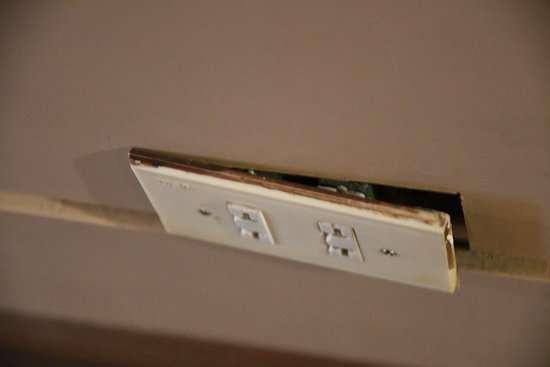
Find the location of a particular element. outlet cover is located at coordinates (425, 258).